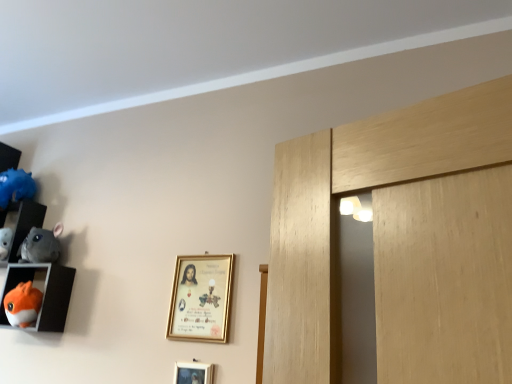
This screenshot has height=384, width=512. What do you see at coordinates (41, 245) in the screenshot?
I see `gray plush chinchilla at left, the 2th toy from the bottom` at bounding box center [41, 245].

In order to face gold metallic picture frame at lower center, placed as the first picture frame when sorted from bottom to top, should I rotate leftwards or rightwards?

Rotate your view left by about 8.431°.

How much space does orange plush toy at lower left, marked as the 3th toy in a top-to-bottom arrangement, occupy vertically?

orange plush toy at lower left, marked as the 3th toy in a top-to-bottom arrangement, is 6.25 inches tall.

Locate an element on the screen. The width and height of the screenshot is (512, 384). matte plastic shelf at left, the 2th shelf in the bottom-to-top sequence is located at coordinates (22, 222).

Which picture frame is the 1st one when counting from the front of the orange plush toy at lower left, placed as the first toy when sorted from bottom to top? Please provide its 2D coordinates.

[(201, 298)]

Can you see orange plush toy at lower left, placed as the first toy when sorted from bottom to top, touching gold metallic picture frame at center, which is counted as the first picture frame, starting from the top?

No, orange plush toy at lower left, placed as the first toy when sorted from bottom to top, is not next to gold metallic picture frame at center, which is counted as the first picture frame, starting from the top.

Looking at this image, is orange plush toy at lower left, marked as the 3th toy in a top-to-bottom arrangement, shorter than gold metallic picture frame at center, which is counted as the first picture frame, starting from the top?

Indeed, orange plush toy at lower left, marked as the 3th toy in a top-to-bottom arrangement, has a lesser height compared to gold metallic picture frame at center, which is counted as the first picture frame, starting from the top.

Is gray plush chinchilla at left, which ranks as the 2th toy in top-to-bottom order, looking in the opposite direction of orange plush toy at lower left, marked as the 3th toy in a top-to-bottom arrangement?

That's not correct — gray plush chinchilla at left, which ranks as the 2th toy in top-to-bottom order, is not looking away from orange plush toy at lower left, marked as the 3th toy in a top-to-bottom arrangement.

Is point (46, 233) less distant than point (23, 307)?

No.

Which object is further away from the camera taking this photo, gray plush chinchilla at left, which ranks as the 2th toy in top-to-bottom order, or orange plush toy at lower left, placed as the first toy when sorted from bottom to top?

gray plush chinchilla at left, which ranks as the 2th toy in top-to-bottom order, is further from the camera.

How different are the orientations of gray plush chinchilla at left, which ranks as the 2th toy in top-to-bottom order, and orange plush toy at lower left, marked as the 3th toy in a top-to-bottom arrangement, in degrees?

gray plush chinchilla at left, which ranks as the 2th toy in top-to-bottom order, and orange plush toy at lower left, marked as the 3th toy in a top-to-bottom arrangement, are facing 0.00011 degrees away from each other.

Considering the sizes of objects gray plush chinchilla at left, which ranks as the 2th toy in top-to-bottom order, and blue fluffy toy at left, which appears as the 3th toy when ordered from the bottom, in the image provided, who is taller, gray plush chinchilla at left, which ranks as the 2th toy in top-to-bottom order, or blue fluffy toy at left, which appears as the 3th toy when ordered from the bottom,?

Standing taller between the two is blue fluffy toy at left, which appears as the 3th toy when ordered from the bottom.

What's the angular difference between gray plush chinchilla at left, which ranks as the 2th toy in top-to-bottom order, and blue fluffy toy at left, which is the 1th toy in top-to-bottom order,'s facing directions?

9.3e-05 degrees.

Are gray plush chinchilla at left, which ranks as the 2th toy in top-to-bottom order, and blue fluffy toy at left, which is the 1th toy in top-to-bottom order, making contact?

gray plush chinchilla at left, which ranks as the 2th toy in top-to-bottom order, and blue fluffy toy at left, which is the 1th toy in top-to-bottom order, are clearly separated.

From a real-world perspective, is gray plush chinchilla at left, which ranks as the 2th toy in top-to-bottom order, positioned above or below blue fluffy toy at left, which is the 1th toy in top-to-bottom order?

Clearly, from a real-world perspective, gray plush chinchilla at left, which ranks as the 2th toy in top-to-bottom order, is below blue fluffy toy at left, which is the 1th toy in top-to-bottom order.

Can you confirm if orange plush toy at left, the 2th shelf positioned from the top, is taller than orange plush toy at lower left, marked as the 3th toy in a top-to-bottom arrangement?

Indeed, orange plush toy at left, the 2th shelf positioned from the top, has a greater height compared to orange plush toy at lower left, marked as the 3th toy in a top-to-bottom arrangement.

From a real-world perspective, is orange plush toy at left, the 2th shelf positioned from the top, on orange plush toy at lower left, placed as the first toy when sorted from bottom to top?

Indeed, from a real-world perspective, orange plush toy at left, the 2th shelf positioned from the top, stands above orange plush toy at lower left, placed as the first toy when sorted from bottom to top.

Consider the image. Is the position of orange plush toy at left, the 2th shelf positioned from the top, more distant than that of orange plush toy at lower left, marked as the 3th toy in a top-to-bottom arrangement?

No, it is in front of orange plush toy at lower left, marked as the 3th toy in a top-to-bottom arrangement.

Does orange plush toy at left, positioned as the first shelf in bottom-to-top order, turn towards orange plush toy at lower left, placed as the first toy when sorted from bottom to top?

Yes, orange plush toy at left, positioned as the first shelf in bottom-to-top order, is oriented towards orange plush toy at lower left, placed as the first toy when sorted from bottom to top.

Does point (24, 287) come farther from viewer compared to point (0, 199)?

That is False.

Which is more to the left, orange plush toy at lower left, marked as the 3th toy in a top-to-bottom arrangement, or blue fluffy toy at left, which is the 1th toy in top-to-bottom order?

From the viewer's perspective, blue fluffy toy at left, which is the 1th toy in top-to-bottom order, appears more on the left side.

Could you tell me if orange plush toy at lower left, placed as the first toy when sorted from bottom to top, is turned towards blue fluffy toy at left, which appears as the 3th toy when ordered from the bottom?

No, orange plush toy at lower left, placed as the first toy when sorted from bottom to top, does not turn towards blue fluffy toy at left, which appears as the 3th toy when ordered from the bottom.

Considering the relative sizes of matte plastic shelf at left, the 2th shelf in the bottom-to-top sequence, and orange plush toy at left, the 2th shelf positioned from the top, in the image provided, is matte plastic shelf at left, the 2th shelf in the bottom-to-top sequence, wider than orange plush toy at left, the 2th shelf positioned from the top,?

Incorrect, the width of matte plastic shelf at left, the 2th shelf in the bottom-to-top sequence, does not surpass that of orange plush toy at left, the 2th shelf positioned from the top.

This screenshot has width=512, height=384. In order to click on shelf in front of the matte plastic shelf at left, the 2th shelf in the bottom-to-top sequence in this screenshot , I will do `click(45, 293)`.

From the image's perspective, relative to orange plush toy at left, positioned as the first shelf in bottom-to-top order, is matte plastic shelf at left, which ranks as the 1th shelf in top-to-bottom order, above or below?

matte plastic shelf at left, which ranks as the 1th shelf in top-to-bottom order, is situated higher than orange plush toy at left, positioned as the first shelf in bottom-to-top order, in the image.

Can you tell me how much matte plastic shelf at left, the 2th shelf in the bottom-to-top sequence, and orange plush toy at left, positioned as the first shelf in bottom-to-top order, differ in facing direction?

The facing directions of matte plastic shelf at left, the 2th shelf in the bottom-to-top sequence, and orange plush toy at left, positioned as the first shelf in bottom-to-top order, are 0.000119 degrees apart.

Can you confirm if gold metallic picture frame at lower center, placed as the first picture frame when sorted from bottom to top, is thinner than gray plush chinchilla at left, which ranks as the 2th toy in top-to-bottom order?

Yes.

Is gold metallic picture frame at lower center, placed as the first picture frame when sorted from bottom to top, bigger than gray plush chinchilla at left, which ranks as the 2th toy in top-to-bottom order?

Actually, gold metallic picture frame at lower center, placed as the first picture frame when sorted from bottom to top, might be smaller than gray plush chinchilla at left, which ranks as the 2th toy in top-to-bottom order.

Could you measure the distance between gold metallic picture frame at lower center, placed as the first picture frame when sorted from bottom to top, and gray plush chinchilla at left, which ranks as the 2th toy in top-to-bottom order?

gold metallic picture frame at lower center, placed as the first picture frame when sorted from bottom to top, is 29.37 inches from gray plush chinchilla at left, which ranks as the 2th toy in top-to-bottom order.

Is point (203, 366) positioned before point (58, 236)?

Yes, point (203, 366) is closer to viewer.

Identify the location of toy below the gold metallic picture frame at center, which is counted as the first picture frame, starting from the top (from a real-world perspective). (23, 305).

The image size is (512, 384). There is a orange plush toy at lower left, placed as the first toy when sorted from bottom to top. Identify the location of the 1st toy above it (from a real-world perspective). (41, 245).

Based on their spatial positions, is blue fluffy toy at left, which appears as the 3th toy when ordered from the bottom, or gold metallic picture frame at center, which is counted as the first picture frame, starting from the top, closer to matte plastic shelf at left, the 2th shelf in the bottom-to-top sequence?

Based on the image, blue fluffy toy at left, which appears as the 3th toy when ordered from the bottom, appears to be nearer to matte plastic shelf at left, the 2th shelf in the bottom-to-top sequence.

From the image, which object appears to be farther from matte plastic shelf at left, which ranks as the 1th shelf in top-to-bottom order, gold metallic picture frame at center, which is counted as the first picture frame, starting from the top, or gray plush chinchilla at left, the 2th toy from the bottom?

gold metallic picture frame at center, which is counted as the first picture frame, starting from the top.

Based on their spatial positions, is gray plush chinchilla at left, the 2th toy from the bottom, or gold metallic picture frame at center, which is counted as the first picture frame, starting from the top, further from gold metallic picture frame at lower center, the second picture frame viewed from the top?

gray plush chinchilla at left, the 2th toy from the bottom, lies further to gold metallic picture frame at lower center, the second picture frame viewed from the top, than the other object.

Which object lies nearer to the anchor point gold metallic picture frame at center, acting as the second picture frame starting from the bottom, gold metallic picture frame at lower center, placed as the first picture frame when sorted from bottom to top, or matte plastic shelf at left, the 2th shelf in the bottom-to-top sequence?

gold metallic picture frame at lower center, placed as the first picture frame when sorted from bottom to top, is positioned closer to the anchor gold metallic picture frame at center, acting as the second picture frame starting from the bottom.

Looking at this image, which object lies further to the anchor point orange plush toy at lower left, placed as the first toy when sorted from bottom to top, orange plush toy at left, the 2th shelf positioned from the top, or gold metallic picture frame at lower center, placed as the first picture frame when sorted from bottom to top?

gold metallic picture frame at lower center, placed as the first picture frame when sorted from bottom to top.

When comparing their distances from blue fluffy toy at left, which appears as the 3th toy when ordered from the bottom, does matte plastic shelf at left, the 2th shelf in the bottom-to-top sequence, or orange plush toy at left, positioned as the first shelf in bottom-to-top order, seem closer?

matte plastic shelf at left, the 2th shelf in the bottom-to-top sequence, is closer to blue fluffy toy at left, which appears as the 3th toy when ordered from the bottom.

When comparing their distances from gold metallic picture frame at center, acting as the second picture frame starting from the bottom, does gray plush chinchilla at left, the 2th toy from the bottom, or orange plush toy at left, positioned as the first shelf in bottom-to-top order, seem further?

gray plush chinchilla at left, the 2th toy from the bottom, is further to gold metallic picture frame at center, acting as the second picture frame starting from the bottom.

Considering their positions, is orange plush toy at left, the 2th shelf positioned from the top, positioned closer to blue fluffy toy at left, which is the 1th toy in top-to-bottom order, than matte plastic shelf at left, the 2th shelf in the bottom-to-top sequence?

matte plastic shelf at left, the 2th shelf in the bottom-to-top sequence.

Image resolution: width=512 pixels, height=384 pixels. I want to click on picture frame situated between orange plush toy at left, positioned as the first shelf in bottom-to-top order, and gold metallic picture frame at center, which is counted as the first picture frame, starting from the top, from left to right, so click(x=193, y=373).

This screenshot has width=512, height=384. I want to click on toy that lies between blue fluffy toy at left, which is the 1th toy in top-to-bottom order, and orange plush toy at left, the 2th shelf positioned from the top, from top to bottom, so click(x=41, y=245).

This screenshot has height=384, width=512. I want to click on picture frame located between matte plastic shelf at left, which ranks as the 1th shelf in top-to-bottom order, and gold metallic picture frame at center, which is counted as the first picture frame, starting from the top, in the left-right direction, so click(193, 373).

This screenshot has height=384, width=512. Find the location of `picture frame between gray plush chinchilla at left, the 2th toy from the bottom, and gold metallic picture frame at center, which is counted as the first picture frame, starting from the top, in the horizontal direction`. picture frame between gray plush chinchilla at left, the 2th toy from the bottom, and gold metallic picture frame at center, which is counted as the first picture frame, starting from the top, in the horizontal direction is located at coordinates (193, 373).